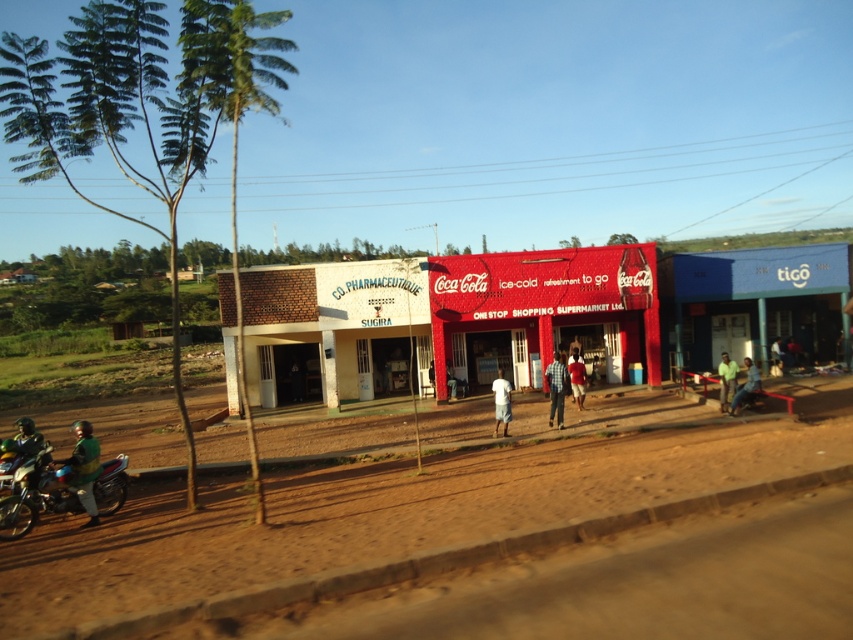
Does green fabric helmet at lower left have a larger size compared to green fabric shirt at lower right?

Yes, green fabric helmet at lower left is bigger than green fabric shirt at lower right.

Looking at this image, who is more forward, (x=73, y=428) or (x=722, y=364)?

Positioned in front is point (x=722, y=364).

Is point (78, 438) positioned in front of point (718, 372)?

Yes, point (78, 438) is in front of point (718, 372).

Locate an element on the screen. This screenshot has width=853, height=640. green fabric helmet at lower left is located at coordinates (84, 468).

Who is higher up, shiny metallic motorbike at lower left or green fabric shirt at lower right?

green fabric shirt at lower right

Is point (50, 500) positioned after point (724, 385)?

That is False.

Between point (6, 540) and point (724, 358), which one is positioned in front?

Point (6, 540) is in front.

Find the location of `shiny metallic motorbike at lower left`. shiny metallic motorbike at lower left is located at coordinates (35, 496).

Can you confirm if red matte coca-cola sign at center is taller than white cotton shorts at center?

Yes, red matte coca-cola sign at center is taller than white cotton shorts at center.

Measure the distance between point [572,273] and camera.

22.67 meters

This screenshot has height=640, width=853. I want to click on red matte coca-cola sign at center, so click(445, 317).